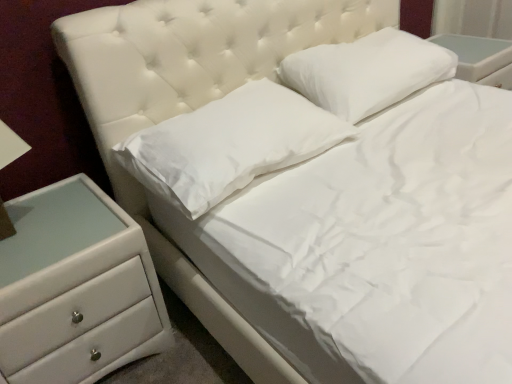
Question: From a real-world perspective, does white soft pillow at center, which is the 2th pillow in right-to-left order, sit lower than white soft pillow at upper center, which is counted as the 1th pillow, starting from the right?

Choices:
 (A) yes
 (B) no

Answer: (A)

Question: From the image's perspective, would you say white soft pillow at center, which is the 2th pillow in right-to-left order, is positioned over white soft pillow at upper center, which appears as the 2th pillow when viewed from the left?

Choices:
 (A) no
 (B) yes

Answer: (A)

Question: Is white soft pillow at center, which is the 2th pillow in right-to-left order, beside white soft pillow at upper center, which appears as the 2th pillow when viewed from the left?

Choices:
 (A) yes
 (B) no

Answer: (B)

Question: Can you confirm if white soft pillow at center, which ranks as the first pillow in left-to-right order, is bigger than white soft pillow at upper center, which appears as the 2th pillow when viewed from the left?

Choices:
 (A) yes
 (B) no

Answer: (B)

Question: Does white soft pillow at center, which ranks as the first pillow in left-to-right order, have a greater height compared to white soft pillow at upper center, which appears as the 2th pillow when viewed from the left?

Choices:
 (A) no
 (B) yes

Answer: (A)

Question: Does white soft pillow at center, which ranks as the first pillow in left-to-right order, have a lesser height compared to white soft pillow at upper center, which appears as the 2th pillow when viewed from the left?

Choices:
 (A) no
 (B) yes

Answer: (B)

Question: Is white soft pillow at center, which ranks as the first pillow in left-to-right order, surrounded by white glossy chest of drawers at lower left?

Choices:
 (A) yes
 (B) no

Answer: (B)

Question: Does white glossy chest of drawers at lower left have a larger size compared to white soft pillow at center, which is the 2th pillow in right-to-left order?

Choices:
 (A) no
 (B) yes

Answer: (B)

Question: Are white glossy chest of drawers at lower left and white soft pillow at center, which is the 2th pillow in right-to-left order, making contact?

Choices:
 (A) no
 (B) yes

Answer: (A)

Question: Would you consider white glossy chest of drawers at lower left to be distant from white soft pillow at center, which is the 2th pillow in right-to-left order?

Choices:
 (A) no
 (B) yes

Answer: (A)

Question: Does white glossy chest of drawers at lower left appear on the left side of white soft pillow at center, which ranks as the first pillow in left-to-right order?

Choices:
 (A) no
 (B) yes

Answer: (B)

Question: Is white glossy chest of drawers at lower left shorter than white soft pillow at center, which is the 2th pillow in right-to-left order?

Choices:
 (A) yes
 (B) no

Answer: (B)

Question: Can you confirm if white soft pillow at upper center, which is counted as the 1th pillow, starting from the right, is positioned to the left of white soft pillow at center, which is the 2th pillow in right-to-left order?

Choices:
 (A) yes
 (B) no

Answer: (B)